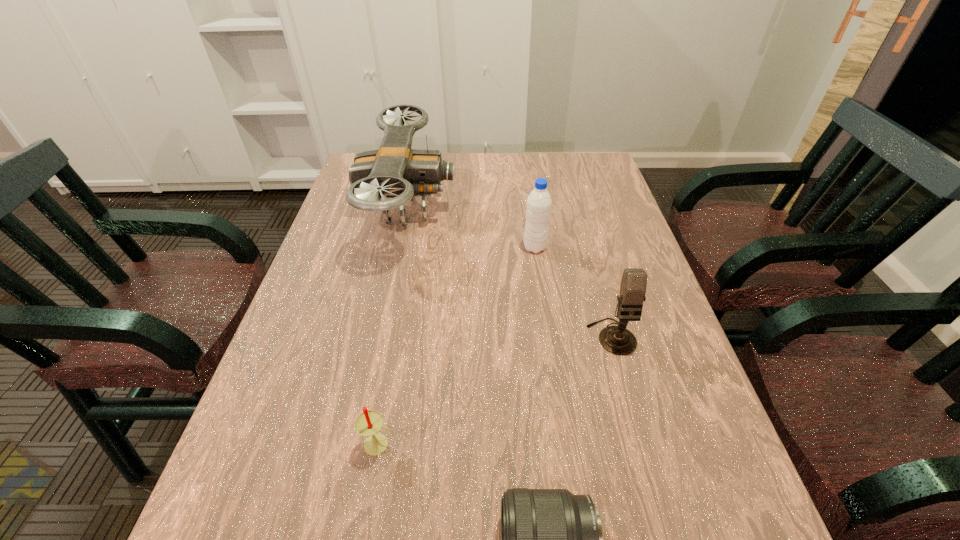
The image size is (960, 540). In order to click on object that is at the left edge in this screenshot , I will do point(396,171).

This screenshot has width=960, height=540. I want to click on object that is at the right edge, so click(x=618, y=340).

I want to click on object that is at the far left corner, so click(396, 171).

The height and width of the screenshot is (540, 960). In order to click on vacant space at the left edge of the desktop in this screenshot , I will do `click(382, 233)`.

The width and height of the screenshot is (960, 540). In order to click on free space at the right edge in this screenshot , I will do `click(596, 214)`.

The height and width of the screenshot is (540, 960). In order to click on free space between the water bottle and the drone in this screenshot , I will do `click(471, 229)`.

Where is `empty space that is in between the drone and the candle`? The width and height of the screenshot is (960, 540). empty space that is in between the drone and the candle is located at coordinates (394, 327).

Identify the location of free area in between the water bottle and the candle. This screenshot has height=540, width=960. (457, 346).

Identify the location of empty space between the fourth farthest object and the water bottle. (457, 346).

At what (x,y) coordinates should I click in order to perform the action: click on vacant point located between the water bottle and the second nearest object. Please return your answer as a coordinate pair (x, y). Image resolution: width=960 pixels, height=540 pixels. Looking at the image, I should click on (457, 346).